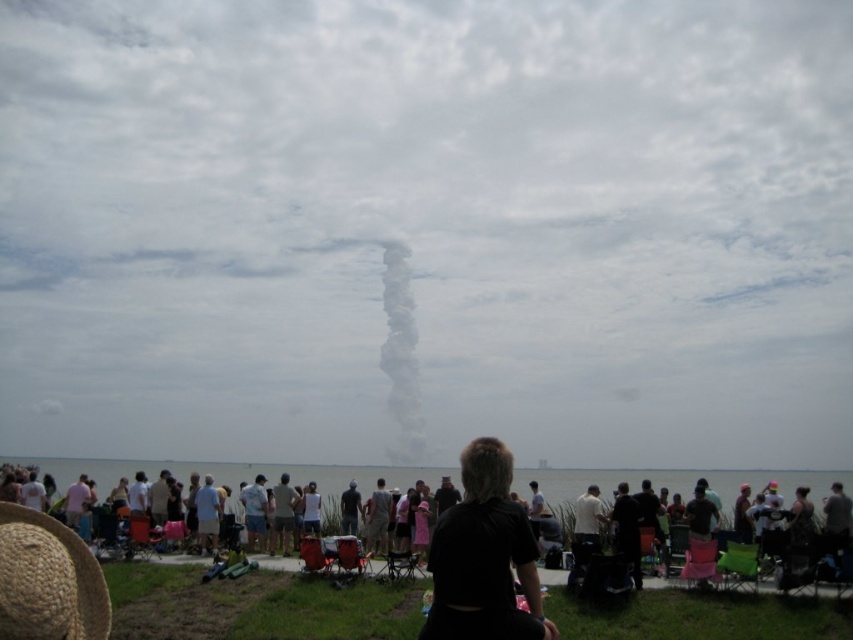
Question: Which of the following is the closest to the observer?

Choices:
 (A) black fabric at center
 (B) light brown fabric pants at center
 (C) dark gray shirt at center

Answer: (A)

Question: Among these objects, which one is nearest to the camera?

Choices:
 (A) black fabric at center
 (B) white fluffy smoke at center
 (C) white smoke plume at center
 (D) dark gray shirt at center

Answer: (A)

Question: Among these objects, which one is farthest from the camera?

Choices:
 (A) dark gray shirt at center
 (B) light brown fabric pants at center
 (C) white fluffy smoke at center

Answer: (C)

Question: Does white fluffy smoke at center appear on the right side of light brown fabric pants at center?

Choices:
 (A) no
 (B) yes

Answer: (B)

Question: Can you confirm if black fabric at center is positioned to the right of white fluffy smoke at center?

Choices:
 (A) yes
 (B) no

Answer: (A)

Question: Can you confirm if black fabric at center is bigger than white fluffy smoke at center?

Choices:
 (A) yes
 (B) no

Answer: (A)